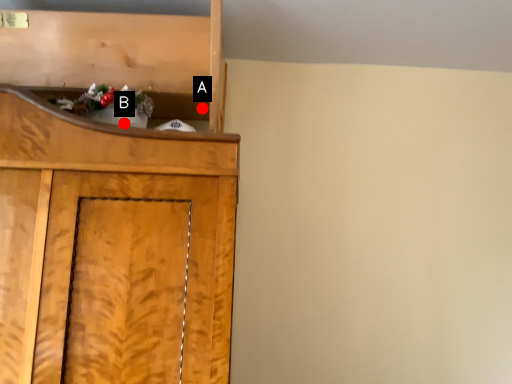
Question: Two points are circled on the image, labeled by A and B beside each circle. Which point is farther to the camera?

Choices:
 (A) A is further
 (B) B is further

Answer: (A)